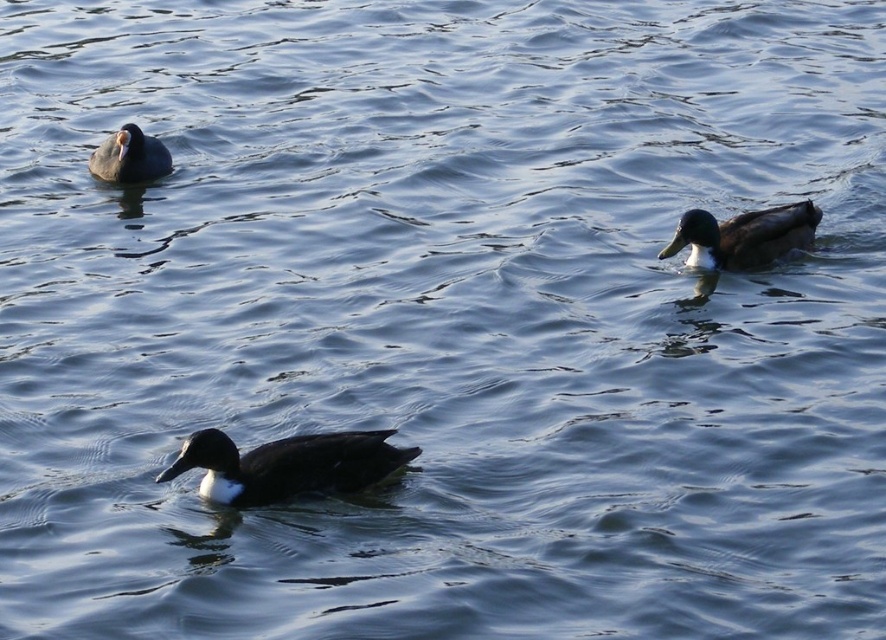
You are standing at the edge of the water and want to throw a stone to hit the point at coordinates point (281, 488). If your maximum throwing distance is 20 feet, will you be able to reach that point?

Answer: The distance of point (281, 488) from viewer is 21.64 feet, which is beyond your maximum throwing distance of 20 feet. Therefore, you cannot reach that point.

You are a photographer trying to capture a photo of the dark brown glossy duck at center and the dark blue feathers at upper left. You want to ensure both are in the frame. Based on their positions, which duck should you focus on first to include both in your shot?

The dark brown glossy duck at center is positioned on the right side of dark blue feathers at upper left, so focusing on the dark blue feathers at upper left first would allow you to frame both ducks in the shot.